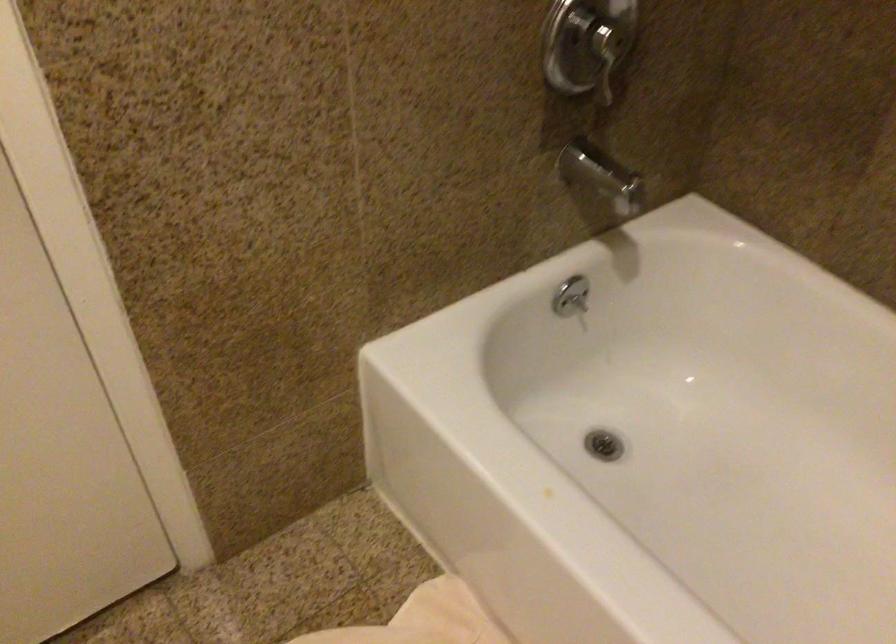
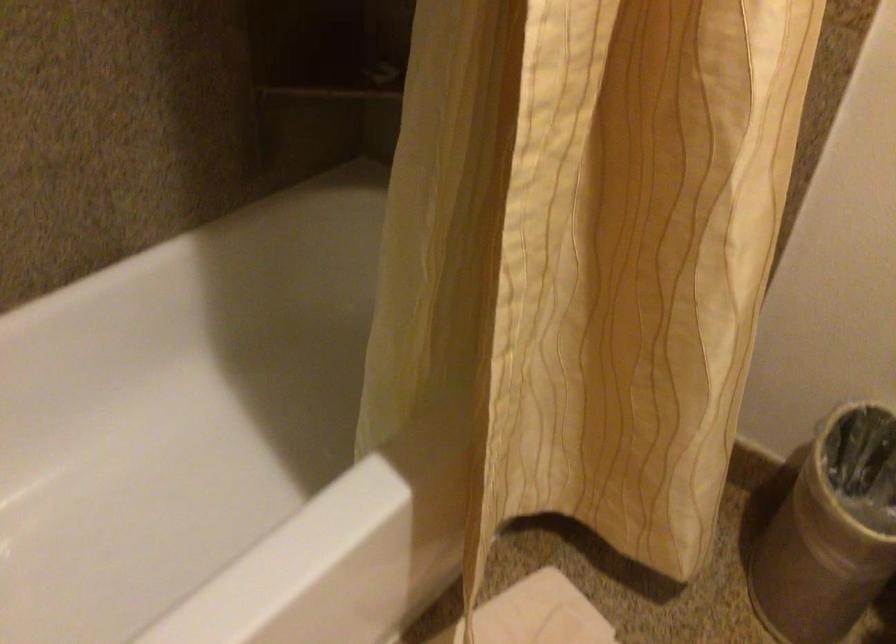
Based on the continuous images, in which direction is the camera rotating?

The rotation direction of the camera is right-down.